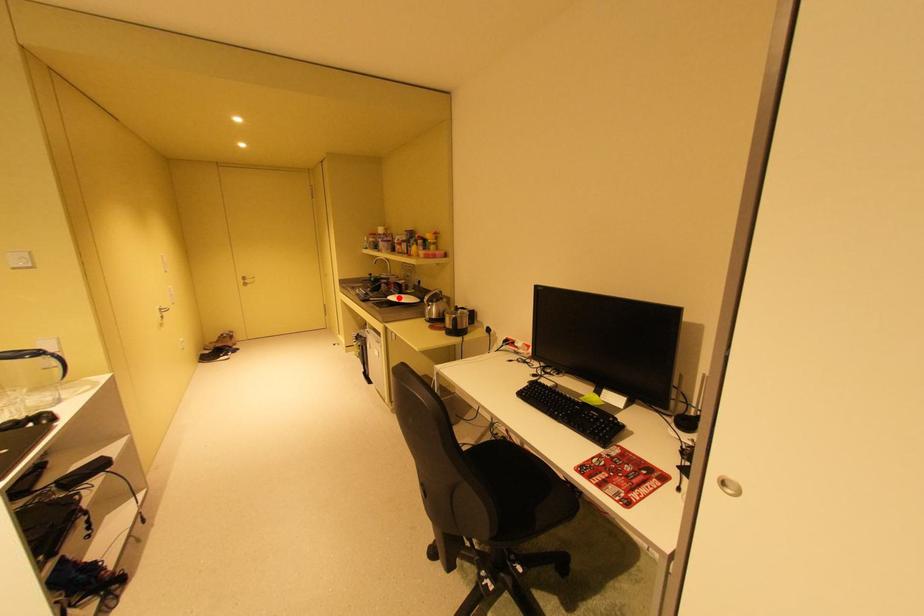
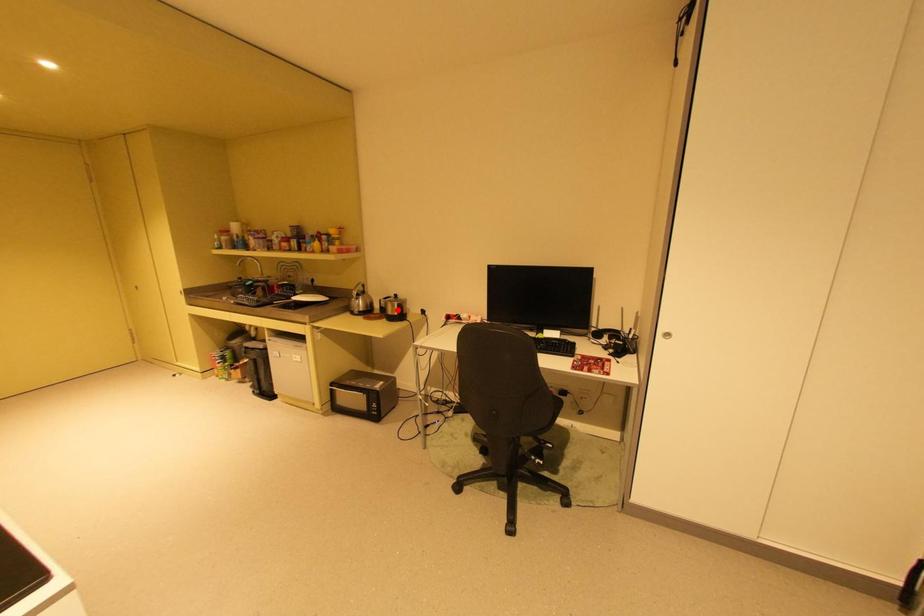
I am providing you with two images of the same scene from different viewpoints. A red point is marked on the first image and another point is marked on the second image. Are the points marked in image1 and image2 representing the same 3D position?

No